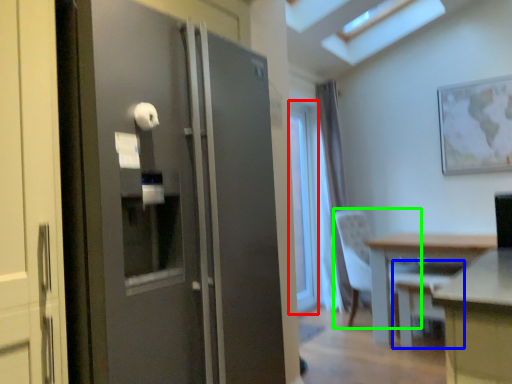
Question: Which is nearer to the window (highlighted by a red box)? swivel chair (highlighted by a blue box) or chair (highlighted by a green box).

Choices:
 (A) swivel chair
 (B) chair

Answer: (B)